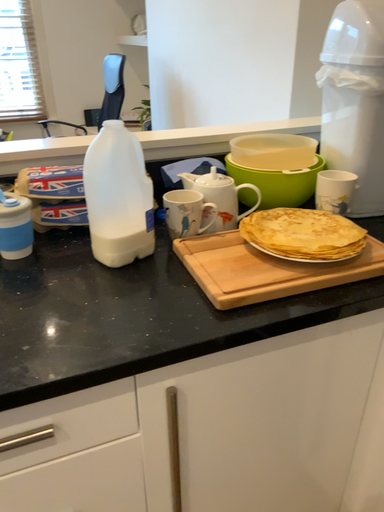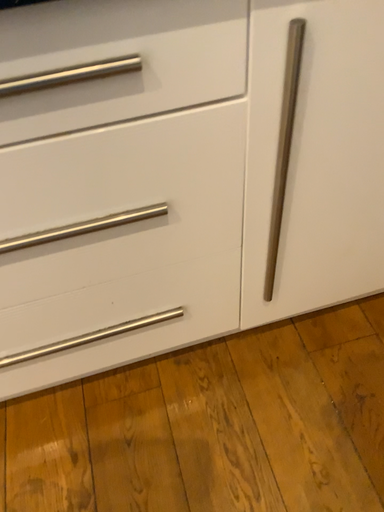
Question: How did the camera likely rotate when shooting the video?

Choices:
 (A) rotated upward
 (B) rotated downward

Answer: (B)